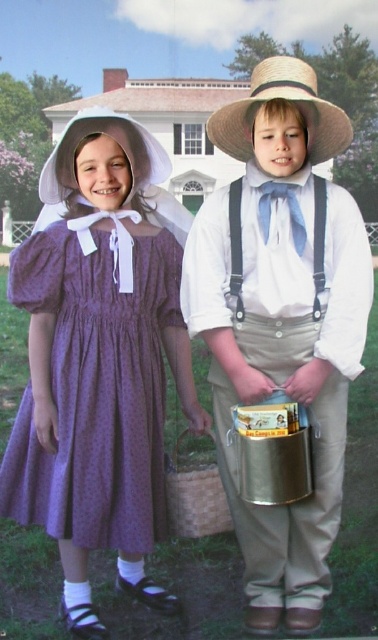
Looking at this image, you are a photographer trying to capture a clear photo of the woven straw basket at center. However, the strawhat at right is blocking your view. Can you move the basket to the left to avoid the hat?

The strawhat at right is in front of the woven straw basket at center, so moving the basket to the left might help avoid the obstruction caused by the strawhat at right.

You are a costume designer preparing for a historical play. You have two props available for the boy character in the scene described. The props are the strawhat at right and the woven straw basket at center. The director wants to ensure that the larger prop is placed on the shelf above the smaller one for display. Which prop should go on the higher shelf?

The strawhat at right has a larger size compared to the woven straw basket at center, so the strawhat at right should be placed on the higher shelf above the woven straw basket at center.

You are a photographer trying to capture a clear shot of both the matte straw hat at center and the purple dotted fabric dress at left. Which object should you focus on first to ensure it appears sharp in the photo?

The matte straw hat at center is closer to the viewer than the purple dotted fabric dress at left, so you should focus on the matte straw hat at center first to ensure it appears sharp in the photo.